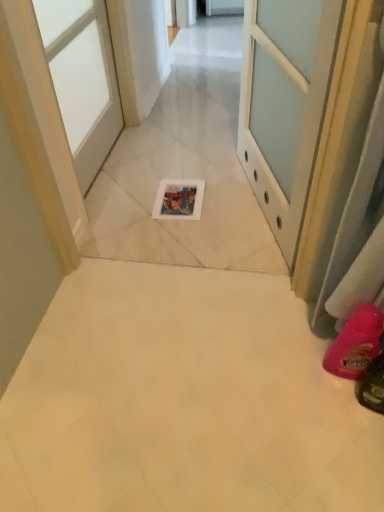
Where is `vacant space that is in between white glossy door at upper center, which appears as the 2th door when viewed from the left, and white glossy door at upper left, acting as the 1th door starting from the left`? This screenshot has width=384, height=512. vacant space that is in between white glossy door at upper center, which appears as the 2th door when viewed from the left, and white glossy door at upper left, acting as the 1th door starting from the left is located at coordinates pyautogui.click(x=181, y=195).